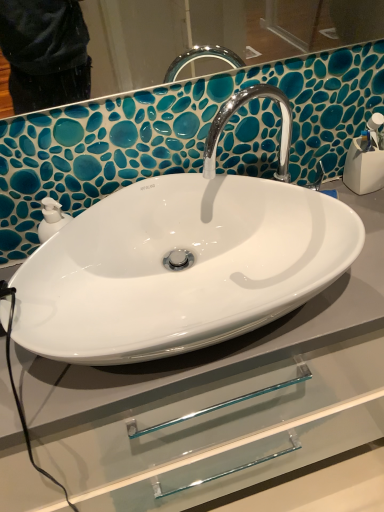
Find the location of a particular element. The width and height of the screenshot is (384, 512). white glossy sink at center is located at coordinates point(182,261).

The image size is (384, 512). Describe the element at coordinates (182, 261) in the screenshot. I see `white glossy sink at center` at that location.

Locate an element on the screen. This screenshot has width=384, height=512. white glossy sink at center is located at coordinates (182, 261).